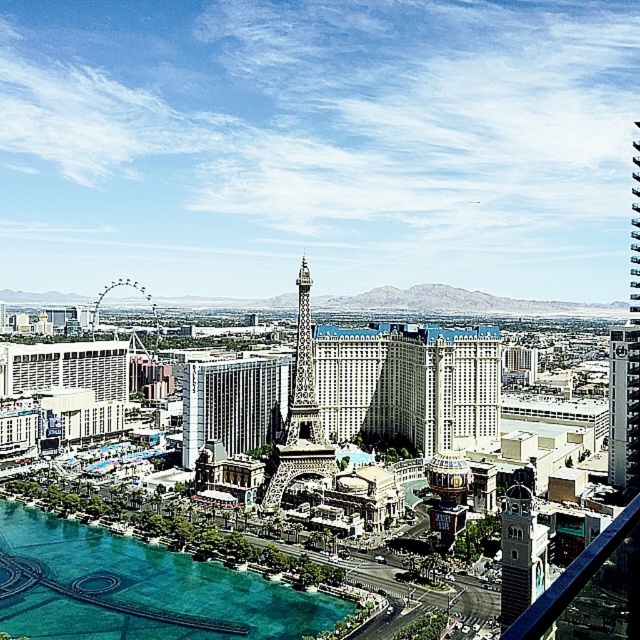
Question: Estimate the real-world distances between objects in this image. Which object is farther from the white glass building at center?

Choices:
 (A) brick tower at center
 (B) shiny metallic eiffel tower at center

Answer: (A)

Question: Observing the image, what is the correct spatial positioning of white glossy hotel at center in reference to brick tower at center?

Choices:
 (A) right
 (B) left

Answer: (A)

Question: Which object is farther from the camera taking this photo?

Choices:
 (A) white glossy hotel at center
 (B) metallic glass skyscraper at right
 (C) metallic silver parking garage at right
 (D) white glass building at center

Answer: (A)

Question: Does metallic glass skyscraper at right appear over white glossy hotel at center?

Choices:
 (A) no
 (B) yes

Answer: (B)

Question: Is metallic glass skyscraper at right positioned behind brick tower at center?

Choices:
 (A) no
 (B) yes

Answer: (B)

Question: Which object is positioned closest to the metallic glass skyscraper at right?

Choices:
 (A) shiny metallic eiffel tower at center
 (B) brick tower at center
 (C) white glossy hotel at center

Answer: (C)